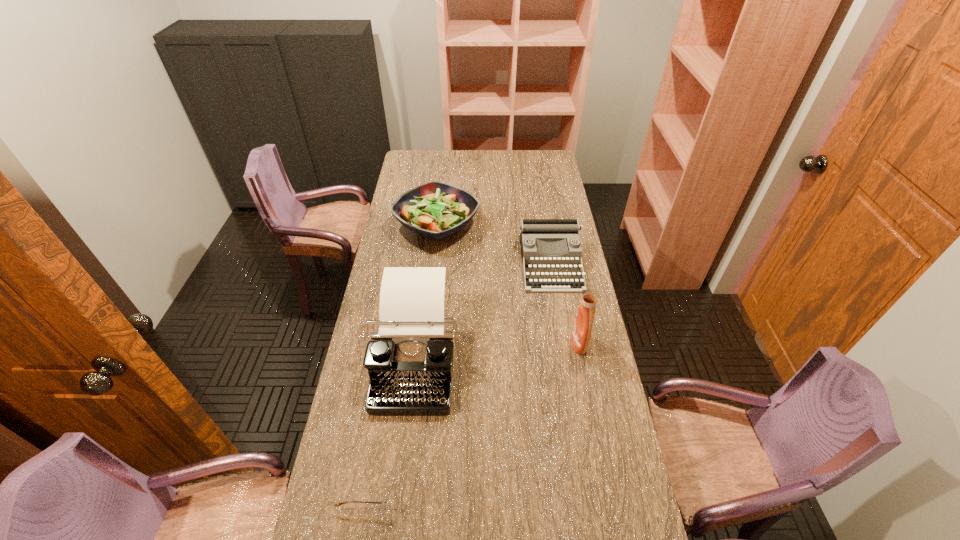
Find the location of a particular element. unoccupied position between the detergent and the salad plate is located at coordinates (508, 284).

The height and width of the screenshot is (540, 960). What are the coordinates of `vacant point located between the shorter typewriter and the detergent` in the screenshot? It's located at (564, 303).

The image size is (960, 540). In order to click on free area in between the taller typewriter and the detergent in this screenshot , I will do `click(495, 350)`.

You are a GUI agent. You are given a task and a screenshot of the screen. Output one action in this format:
    pyautogui.click(x=<x>, y=<y>)
    Task: Click on the free space between the detergent and the salad plate
    This screenshot has width=960, height=540.
    Given the screenshot: What is the action you would take?
    pyautogui.click(x=508, y=284)

The width and height of the screenshot is (960, 540). What are the coordinates of `blank region between the detergent and the third shortest object` in the screenshot? It's located at (508, 284).

Where is `object that is the fourth nearest to the salad plate`? The width and height of the screenshot is (960, 540). object that is the fourth nearest to the salad plate is located at coordinates (390, 517).

Identify the location of object that stands as the third closest to the fourth shortest object. This screenshot has height=540, width=960. (436, 210).

This screenshot has height=540, width=960. I want to click on vacant point that satisfies the following two spatial constraints: 1. on the front-facing side of the detergent; 2. on the keys of the nearer typewriter, so click(582, 357).

Image resolution: width=960 pixels, height=540 pixels. I want to click on vacant area that satisfies the following two spatial constraints: 1. on the front-facing side of the detergent; 2. on the keys of the taller typewriter, so click(x=582, y=357).

The height and width of the screenshot is (540, 960). I want to click on free location that satisfies the following two spatial constraints: 1. on the front-facing side of the detergent; 2. on the keys of the left typewriter, so click(x=582, y=357).